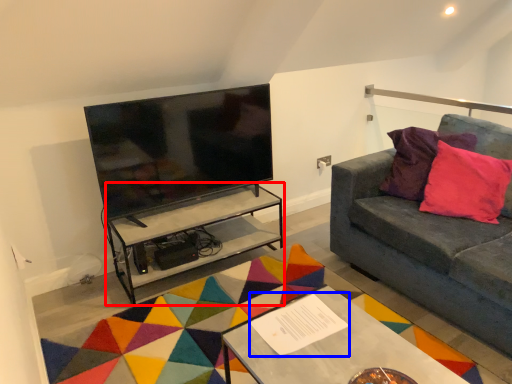
Question: Which point is further to the camera, table (highlighted by a red box) or square (highlighted by a blue box)?

Choices:
 (A) table
 (B) square

Answer: (A)